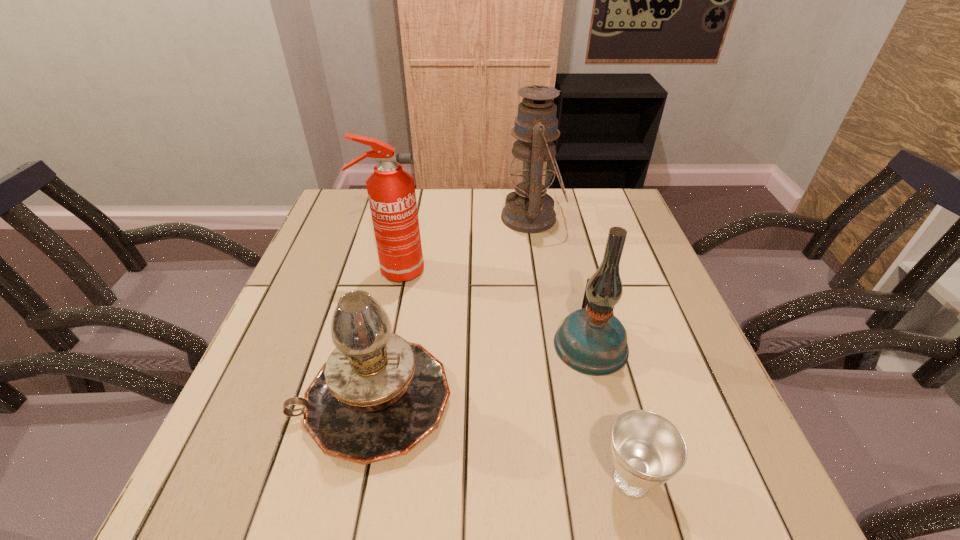
Image resolution: width=960 pixels, height=540 pixels. Find the location of `the farthest object`. the farthest object is located at coordinates (529, 209).

Image resolution: width=960 pixels, height=540 pixels. I want to click on the tallest oil lamp, so click(529, 209).

Where is `the fourth nearest object`? the fourth nearest object is located at coordinates (391, 191).

Identify the location of the leftmost oil lamp. This screenshot has height=540, width=960. (377, 397).

The image size is (960, 540). Find the location of `the shortest object`. the shortest object is located at coordinates (x=647, y=450).

The image size is (960, 540). I want to click on free space located 0.170m on the front of the tallest oil lamp, so click(542, 283).

This screenshot has height=540, width=960. What are the coordinates of `vacant area located 0.170m at the nozzle of the fourth nearest object` in the screenshot? It's located at (491, 272).

Identify the location of vacant space located on the left of the leftmost oil lamp. (243, 400).

Find the location of a particular element. The width and height of the screenshot is (960, 540). free space located on the left of the shortest object is located at coordinates (423, 480).

What are the coordinates of `object that is at the far edge` in the screenshot? It's located at (529, 209).